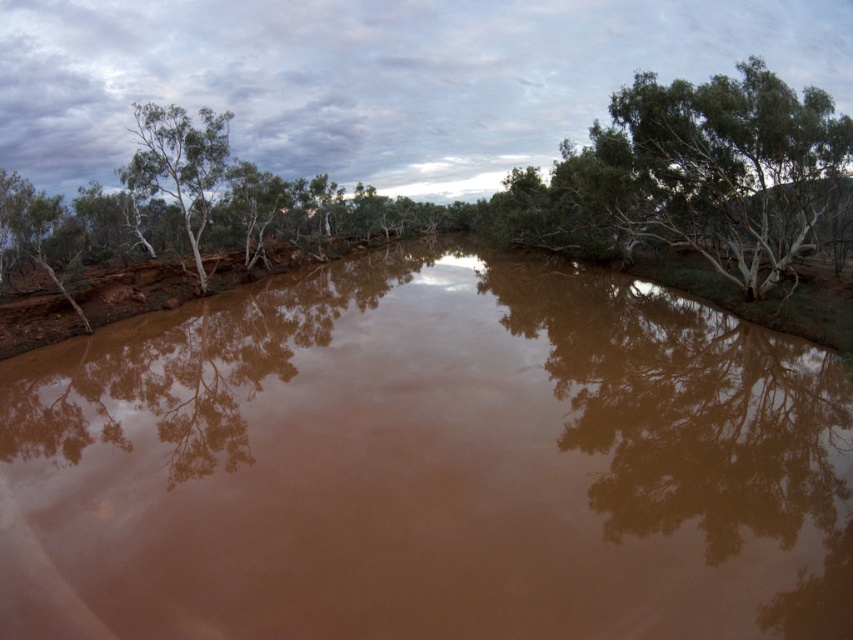
Based on the photo, you are standing at the point labeled as point (428, 465) in the image. What do you see directly below you?

The point (428, 465) indicates brown matte water at center, so you are standing directly above the brown matte water at center.